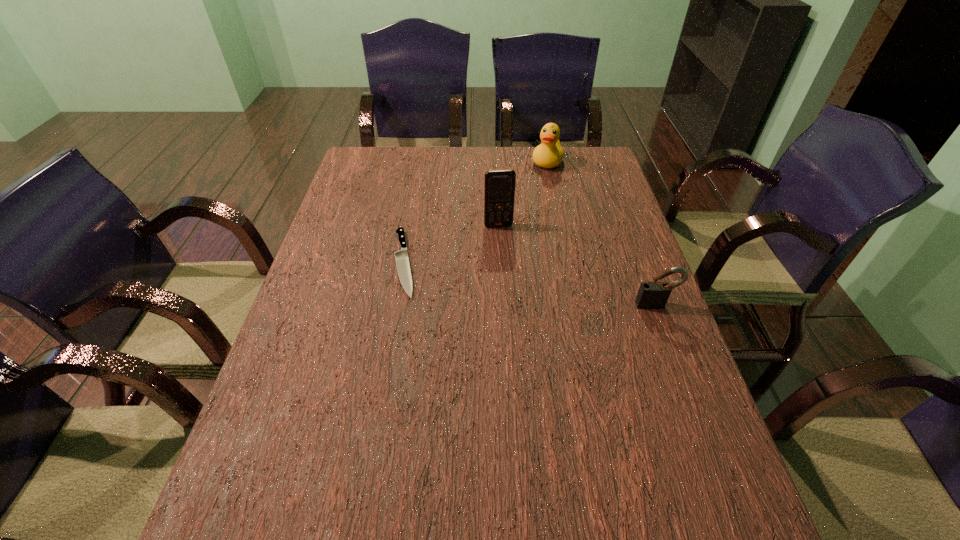
Find the location of a particular element. The height and width of the screenshot is (540, 960). blank space at the far edge of the desktop is located at coordinates (541, 168).

In the image, there is a desktop. What are the coordinates of `vacant region at the near edge` in the screenshot? It's located at (582, 453).

Where is `vacant area at the left edge`? vacant area at the left edge is located at coordinates (296, 373).

Find the location of a particular element. free space at the right edge of the desktop is located at coordinates (620, 243).

The height and width of the screenshot is (540, 960). I want to click on vacant space at the far left corner of the desktop, so click(x=385, y=147).

Identify the location of vacant area at the near left corner of the desktop. (256, 457).

In the image, there is a desktop. Identify the location of vacant space at the far right corner. (591, 179).

Find the location of a particular element. The height and width of the screenshot is (540, 960). free space that is in between the nearest object and the second nearest object is located at coordinates pos(530,284).

Image resolution: width=960 pixels, height=540 pixels. In order to click on free point between the tallest object and the second nearest object in this screenshot , I will do `click(451, 244)`.

Where is `empty space that is in between the cellular telephone and the farthest object`? The image size is (960, 540). empty space that is in between the cellular telephone and the farthest object is located at coordinates (523, 194).